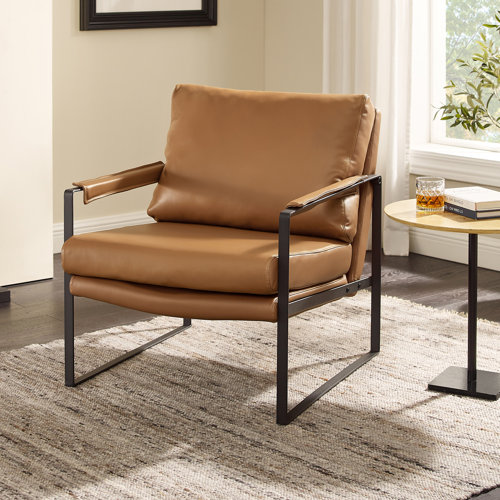
This screenshot has height=500, width=500. I want to click on wooden side table, so click(x=455, y=225).